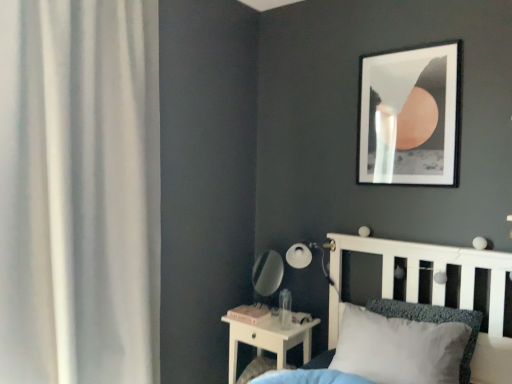
Locate an element on the screen. The image size is (512, 384). vacant space underneath shiny silver mirror at center (from a real-world perspective) is located at coordinates (274, 312).